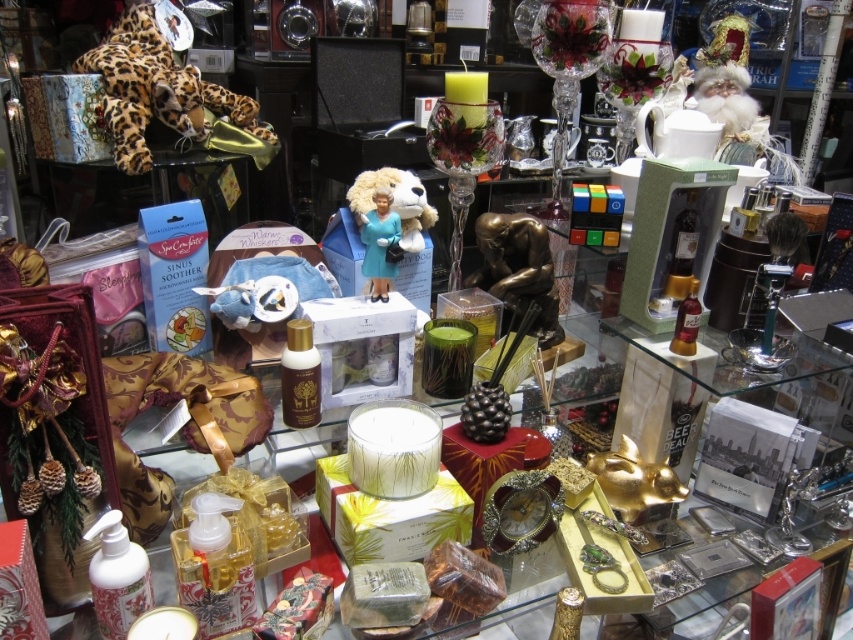
Question: Can you confirm if leopard print plush at upper left is positioned to the left of blue glossy figurine at center?

Choices:
 (A) no
 (B) yes

Answer: (B)

Question: Does leopard print plush at upper left appear on the right side of blue glossy figurine at center?

Choices:
 (A) no
 (B) yes

Answer: (A)

Question: Where is leopard print plush at upper left located in relation to blue glossy figurine at center in the image?

Choices:
 (A) right
 (B) left

Answer: (B)

Question: Which object appears closest to the camera in this image?

Choices:
 (A) blue glossy figurine at center
 (B) leopard print plush at upper left

Answer: (A)

Question: Which object appears farthest from the camera in this image?

Choices:
 (A) blue glossy figurine at center
 (B) leopard print plush at upper left

Answer: (B)